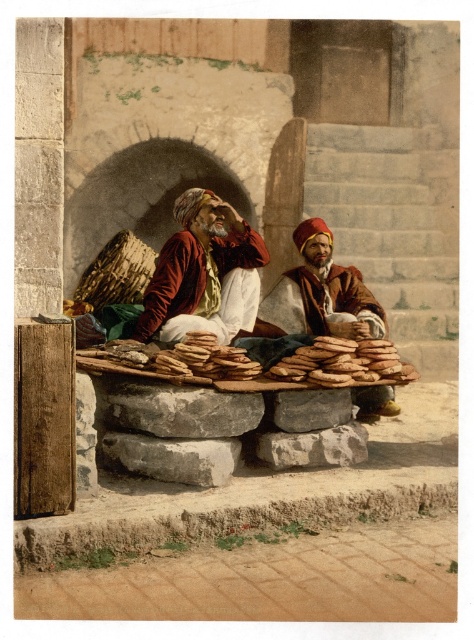
In the scene shown: You are a visitor at this historical site and want to take a photo of both the matte red turban at center and the brown leather turban at center. However, you notice that one is blocking the other. Which turban should you move to ensure both are visible in your photo?

The matte red turban at center is in front of the brown leather turban at center. To ensure both are visible, you should move the matte red turban at center slightly backward or the brown leather turban at center slightly forward so they are not overlapping.

You are a photographer standing at the camera position. You want to take a closeup of the matte red turban at center. Which direction should you move to get closer to it?

You should move forward towards the matte red turban at center since it is located at point 0.430 on the vertical axis, which is closer to the camera than other objects.

You are a merchant in this historical setting and need to determine which turban can hold more items between the matte red turban at center and the brown leather turban at center. Which one would you choose?

The brown leather turban at center is thicker than the matte red turban at center, so it can hold more items.